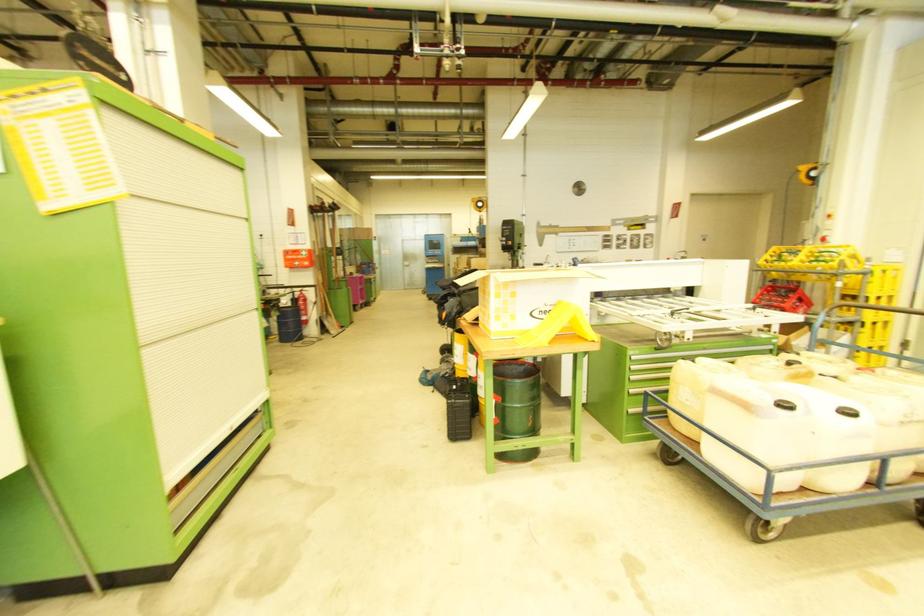
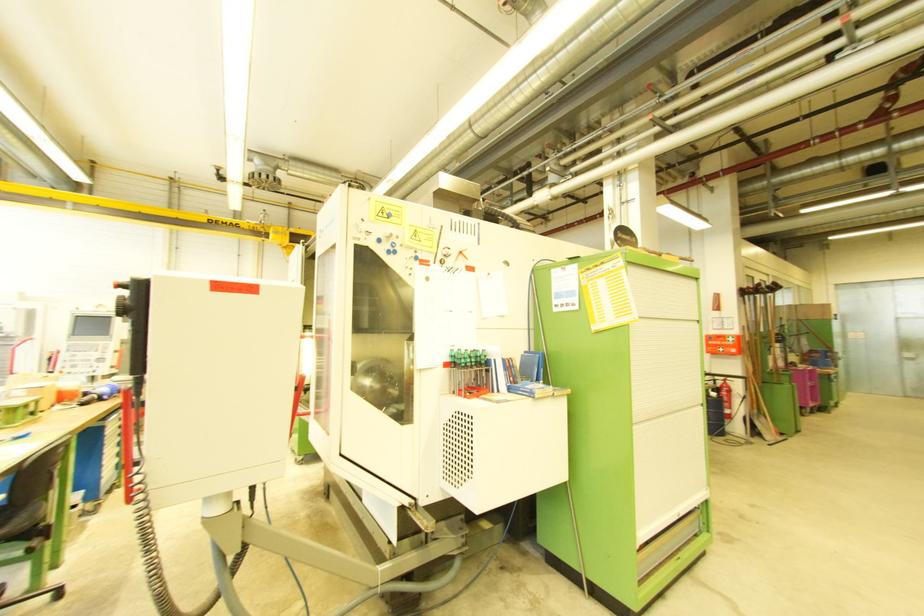
In the second image, find the point that corresponds to the point at 314,285 in the first image.

(740, 376)